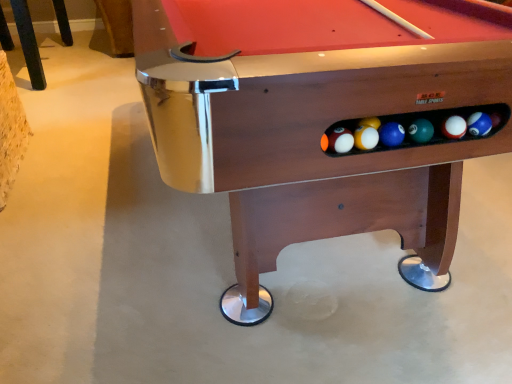
The width and height of the screenshot is (512, 384). I want to click on wooden billiard table at center, so click(x=319, y=118).

Describe the element at coordinates (319, 118) in the screenshot. This screenshot has height=384, width=512. I see `wooden billiard table at center` at that location.

The width and height of the screenshot is (512, 384). What do you see at coordinates (29, 43) in the screenshot?
I see `wooden chair leg at upper left` at bounding box center [29, 43].

Where is `wooden chair leg at upper left`? This screenshot has height=384, width=512. wooden chair leg at upper left is located at coordinates (29, 43).

Identify the location of wooden billiard table at center. (319, 118).

Which object is positioned more to the left, wooden chair leg at upper left or wooden billiard table at center?

wooden chair leg at upper left.

Is the position of wooden chair leg at upper left more distant than that of wooden billiard table at center?

Yes, wooden chair leg at upper left is further from the viewer.

Considering the points (31, 43) and (359, 217), which point is in front, point (31, 43) or point (359, 217)?

Positioned in front is point (359, 217).

From the image's perspective, is wooden chair leg at upper left above wooden billiard table at center?

Yes, from the image's perspective, wooden chair leg at upper left is on top of wooden billiard table at center.

From a real-world perspective, does wooden chair leg at upper left stand above wooden billiard table at center?

No.

In terms of width, does wooden chair leg at upper left look wider or thinner when compared to wooden billiard table at center?

Considering their sizes, wooden chair leg at upper left looks slimmer than wooden billiard table at center.

Is wooden chair leg at upper left taller or shorter than wooden billiard table at center?

In the image, wooden chair leg at upper left appears to be shorter than wooden billiard table at center.

Is wooden chair leg at upper left bigger than wooden billiard table at center?

Actually, wooden chair leg at upper left might be smaller than wooden billiard table at center.

Choose the correct answer: Is wooden chair leg at upper left inside wooden billiard table at center or outside it?

The correct answer is: outside.

Is wooden chair leg at upper left placed right next to wooden billiard table at center?

They are not placed beside each other.

Is wooden chair leg at upper left facing towards wooden billiard table at center?

No, wooden chair leg at upper left is not oriented towards wooden billiard table at center.

Can you tell me how much wooden chair leg at upper left and wooden billiard table at center differ in facing direction?

2.32 degrees separate the facing orientations of wooden chair leg at upper left and wooden billiard table at center.

How distant is wooden chair leg at upper left from wooden billiard table at center?

wooden chair leg at upper left and wooden billiard table at center are 7.32 feet apart.

At what (x,y) coordinates should I click in order to perform the action: click on furniture above the wooden billiard table at center (from the image's perspective). Please return your answer as a coordinate pair (x, y). The height and width of the screenshot is (384, 512). Looking at the image, I should click on (29, 43).

In the image, is wooden billiard table at center on the left side or the right side of wooden chair leg at upper left?

From the image, it's evident that wooden billiard table at center is to the right of wooden chair leg at upper left.

Considering the positions of objects wooden billiard table at center and wooden chair leg at upper left in the image provided, who is behind, wooden billiard table at center or wooden chair leg at upper left?

Positioned behind is wooden chair leg at upper left.

Does point (232, 73) come closer to viewer compared to point (22, 16)?

Yes, it is.

From the image's perspective, relative to wooden chair leg at upper left, is wooden billiard table at center above or below?

Clearly, from the image's perspective, wooden billiard table at center is below wooden chair leg at upper left.

From a real-world perspective, who is located higher, wooden billiard table at center or wooden chair leg at upper left?

From a 3D spatial view, wooden billiard table at center is above.

Considering the sizes of objects wooden billiard table at center and wooden chair leg at upper left in the image provided, who is wider, wooden billiard table at center or wooden chair leg at upper left?

Wider between the two is wooden billiard table at center.

Does wooden billiard table at center have a greater height compared to wooden chair leg at upper left?

Correct, wooden billiard table at center is much taller as wooden chair leg at upper left.

Looking at the image, does wooden billiard table at center seem bigger or smaller compared to wooden chair leg at upper left?

In the image, wooden billiard table at center appears to be larger than wooden chair leg at upper left.

Is wooden chair leg at upper left inside wooden billiard table at center?

That's incorrect, wooden chair leg at upper left is not inside wooden billiard table at center.

Is wooden billiard table at center beside wooden chair leg at upper left?

No, wooden billiard table at center is not in contact with wooden chair leg at upper left.

Is wooden chair leg at upper left at the back of wooden billiard table at center?

No.

Measure the distance from wooden billiard table at center to wooden chair leg at upper left.

A distance of 2.23 meters exists between wooden billiard table at center and wooden chair leg at upper left.

Where is `furniture on the left of the wooden billiard table at center`? The height and width of the screenshot is (384, 512). furniture on the left of the wooden billiard table at center is located at coordinates 29,43.

You are a GUI agent. You are given a task and a screenshot of the screen. Output one action in this format:
    pyautogui.click(x=<x>, y=<y>)
    Task: Click on the billiard table below the wooden chair leg at upper left (from the image's perspective)
    
    Given the screenshot: What is the action you would take?
    pyautogui.click(x=319, y=118)

I want to click on furniture behind the wooden billiard table at center, so click(29, 43).